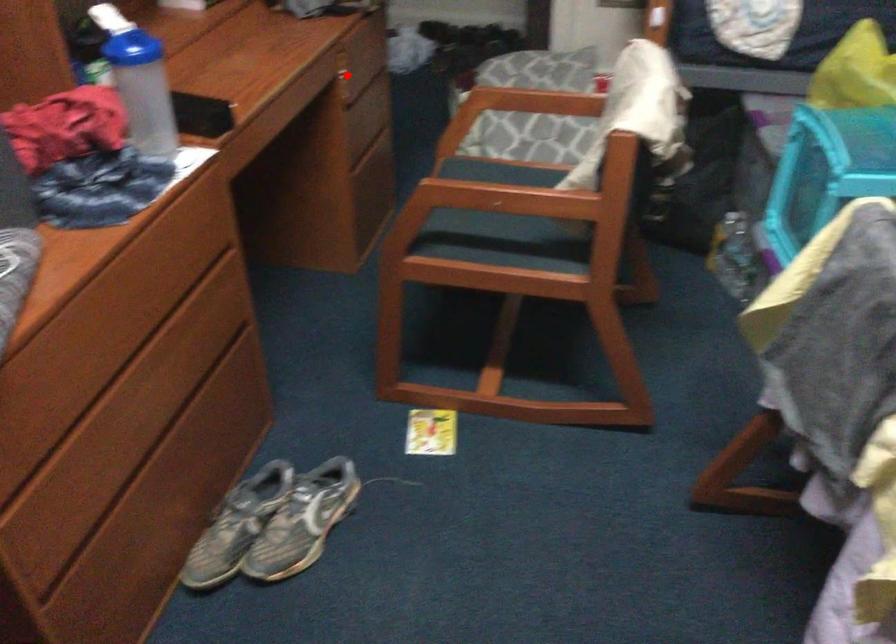
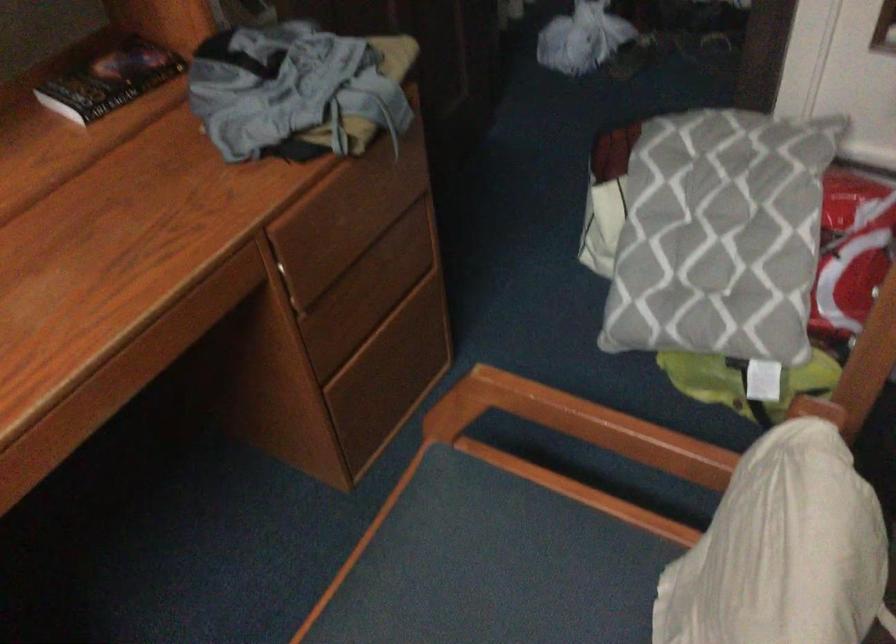
Question: I am providing you with two images of the same scene from different viewpoints. Given a red point in image1, look at the same physical point in image2. Is it:

Choices:
 (A) Closer to the viewpoint
 (B) Farther from the viewpoint

Answer: (A)